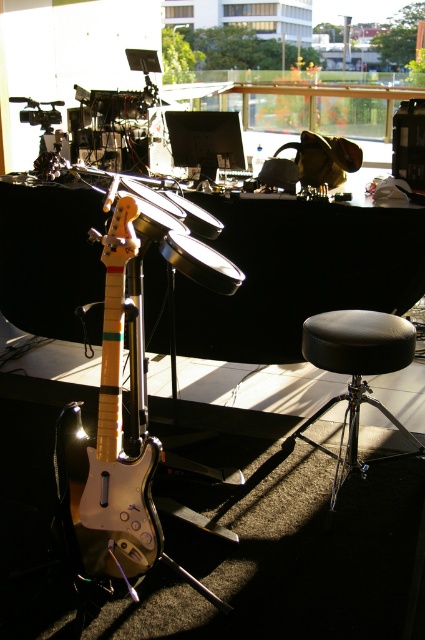
You are a sound engineer setting up for a live performance. You need to position a microphone stand between the glossy wood guitar at center and the black leather stool at lower right. The microphone stand requires at least 24 inches of space to be placed safely. Can you fit it between them?

The glossy wood guitar at center is 34.09 inches away from the black leather stool at lower right. Since the required space is 24 inches, the microphone stand can be placed between them as there is enough space.

You are a technician adjusting the camera angle to focus on two specific points in the music setup. The first point is at coordinate point[119,416] and the second is at point[306,422]. Which point will appear larger in the camera view?

Point[119,416] is closer to the camera than point[306,422], so it will appear larger in the camera view.